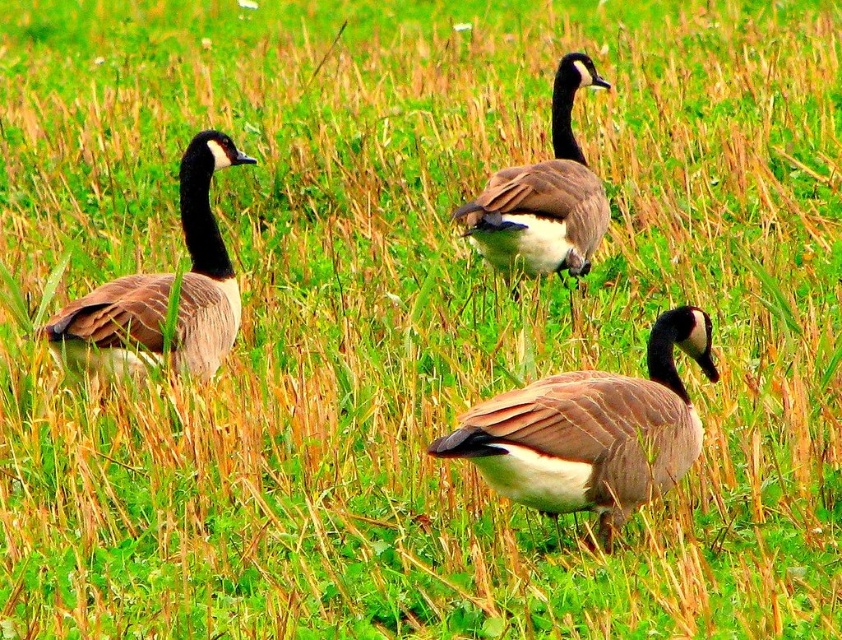
Question: Is brown matte duck at center above brown matte goose at center?

Choices:
 (A) yes
 (B) no

Answer: (B)

Question: From the image, what is the correct spatial relationship of brown matte duck at left in relation to brown matte goose at center?

Choices:
 (A) left
 (B) right

Answer: (A)

Question: Which point is closer to the camera taking this photo?

Choices:
 (A) (483, 230)
 (B) (230, 269)

Answer: (B)

Question: Which is nearer to the brown matte duck at left?

Choices:
 (A) brown matte duck at center
 (B) brown matte goose at center

Answer: (B)

Question: Estimate the real-world distances between objects in this image. Which object is farther from the brown matte duck at left?

Choices:
 (A) brown matte goose at center
 (B) brown matte duck at center

Answer: (B)

Question: Does brown matte duck at left appear on the left side of brown matte goose at center?

Choices:
 (A) yes
 (B) no

Answer: (A)